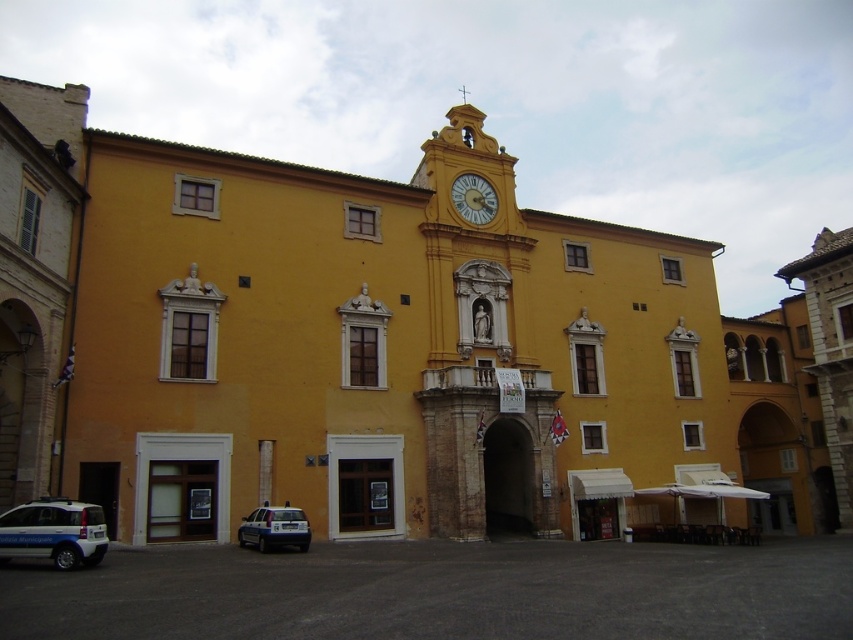
In the scene shown: You are a delivery driver trying to park your white glossy car at lower left next to the white glossy police car at lower left. Can your car fit in the available space if the police car is already occupying part of it?

The white glossy car at lower left is wider than the white glossy police car at lower left, so it may not fit in the space occupied by the police car unless there is additional room.

You are a tourist standing in front of the yellow building. You see a white glossy car at lower left and a golden metallic clock at upper center. Which object is larger in size?

The white glossy car at lower left is bigger than the golden metallic clock at upper center.